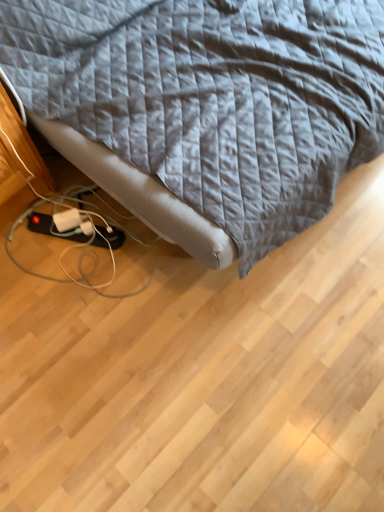
Identify the location of white plastic extension cord at lower left. (67, 220).

Describe the element at coordinates (67, 220) in the screenshot. This screenshot has height=512, width=384. I see `white plastic extension cord at lower left` at that location.

Measure the distance between point (63, 218) and camera.

Point (63, 218) and camera are 4.62 feet apart from each other.

Describe the element at coordinates (213, 97) in the screenshot. I see `gray quilted fabric at upper center` at that location.

The image size is (384, 512). Identify the location of gray quilted fabric at upper center. (213, 97).

The height and width of the screenshot is (512, 384). I want to click on white plastic extension cord at lower left, so click(67, 220).

Between gray quilted fabric at upper center and white plastic extension cord at lower left, which one appears on the left side from the viewer's perspective?

From the viewer's perspective, white plastic extension cord at lower left appears more on the left side.

Is gray quilted fabric at upper center closer to the viewer compared to white plastic extension cord at lower left?

Yes, the depth of gray quilted fabric at upper center is less than that of white plastic extension cord at lower left.

Which is more distant, (x=290, y=136) or (x=69, y=215)?

The point (x=69, y=215) is farther from the camera.

From the image's perspective, which one is positioned higher, gray quilted fabric at upper center or white plastic extension cord at lower left?

gray quilted fabric at upper center.

From a real-world perspective, is gray quilted fabric at upper center positioned over white plastic extension cord at lower left based on gravity?

Yes, from a real-world perspective, gray quilted fabric at upper center is on top of white plastic extension cord at lower left.

Which of these two, gray quilted fabric at upper center or white plastic extension cord at lower left, is thinner?

Thinner between the two is white plastic extension cord at lower left.

Is gray quilted fabric at upper center taller or shorter than white plastic extension cord at lower left?

Clearly, gray quilted fabric at upper center is taller compared to white plastic extension cord at lower left.

Which of these two, gray quilted fabric at upper center or white plastic extension cord at lower left, is smaller?

With smaller size is white plastic extension cord at lower left.

Can white plastic extension cord at lower left be found inside gray quilted fabric at upper center?

No, white plastic extension cord at lower left is located outside of gray quilted fabric at upper center.

Is there a large distance between gray quilted fabric at upper center and white plastic extension cord at lower left?

That's not correct — gray quilted fabric at upper center is a little close to white plastic extension cord at lower left.

Based on the photo, is gray quilted fabric at upper center positioned with its back to white plastic extension cord at lower left?

No.

From the picture: How many degrees apart are the facing directions of gray quilted fabric at upper center and white plastic extension cord at lower left?

64.9 degrees separate the facing orientations of gray quilted fabric at upper center and white plastic extension cord at lower left.

Where is `extension cord that is below the gray quilted fabric at upper center (from the image's perspective)`? The image size is (384, 512). extension cord that is below the gray quilted fabric at upper center (from the image's perspective) is located at coordinates (67, 220).

Considering the relative positions of white plastic extension cord at lower left and gray quilted fabric at upper center in the image provided, is white plastic extension cord at lower left to the left or to the right of gray quilted fabric at upper center?

Based on their positions, white plastic extension cord at lower left is located to the left of gray quilted fabric at upper center.

Which is in front, white plastic extension cord at lower left or gray quilted fabric at upper center?

gray quilted fabric at upper center.

Is point (67, 218) closer or farther from the camera than point (230, 129)?

Clearly, point (67, 218) is more distant from the camera than point (230, 129).

From the image's perspective, is white plastic extension cord at lower left above or below gray quilted fabric at upper center?

Based on their image positions, white plastic extension cord at lower left is located beneath gray quilted fabric at upper center.

From a real-world perspective, who is located higher, white plastic extension cord at lower left or gray quilted fabric at upper center?

gray quilted fabric at upper center is physically above.

Considering the sizes of objects white plastic extension cord at lower left and gray quilted fabric at upper center in the image provided, who is thinner, white plastic extension cord at lower left or gray quilted fabric at upper center?

white plastic extension cord at lower left is thinner.

Is white plastic extension cord at lower left taller than gray quilted fabric at upper center?

No.

Can you confirm if white plastic extension cord at lower left is bigger than gray quilted fabric at upper center?

No.

Consider the image. Is white plastic extension cord at lower left inside or outside of gray quilted fabric at upper center?

white plastic extension cord at lower left is outside gray quilted fabric at upper center.

Are white plastic extension cord at lower left and gray quilted fabric at upper center beside each other?

→ No.

Could you tell me if white plastic extension cord at lower left is turned towards gray quilted fabric at upper center?

Yes, white plastic extension cord at lower left is aimed at gray quilted fabric at upper center.

How many degrees apart are the facing directions of white plastic extension cord at lower left and gray quilted fabric at upper center?

The angular difference between white plastic extension cord at lower left and gray quilted fabric at upper center is 64.9 degrees.

The height and width of the screenshot is (512, 384). In order to click on bed located above the white plastic extension cord at lower left (from a real-world perspective) in this screenshot , I will do `click(213, 97)`.

Identify the location of extension cord behind the gray quilted fabric at upper center. [x=67, y=220].

Locate an element on the screen. extension cord that is below the gray quilted fabric at upper center (from the image's perspective) is located at coordinates 67,220.